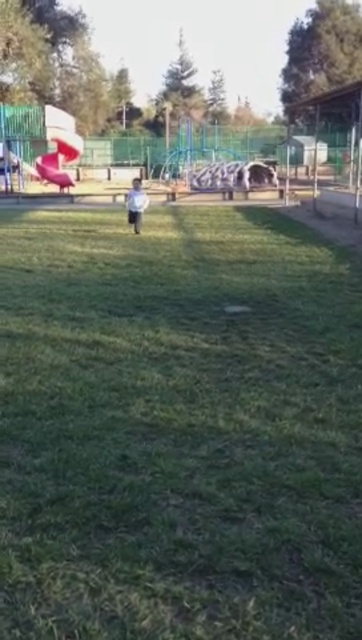
Question: Which object is positioned closest to the smooth plastic slide at upper left?

Choices:
 (A) white matte shirt at center
 (B) green grassy field at center

Answer: (A)

Question: Can you confirm if smooth plastic slide at upper left is positioned to the left of white matte shirt at center?

Choices:
 (A) yes
 (B) no

Answer: (A)

Question: Can you confirm if green grassy field at center is positioned to the right of smooth plastic slide at upper left?

Choices:
 (A) no
 (B) yes

Answer: (B)

Question: Does green grassy field at center appear over smooth plastic slide at upper left?

Choices:
 (A) yes
 (B) no

Answer: (B)

Question: Which object is positioned closest to the smooth plastic slide at upper left?

Choices:
 (A) green grassy field at center
 (B) white matte shirt at center

Answer: (B)

Question: Which of the following is the farthest from the observer?

Choices:
 (A) (135, 211)
 (B) (66, 224)

Answer: (B)